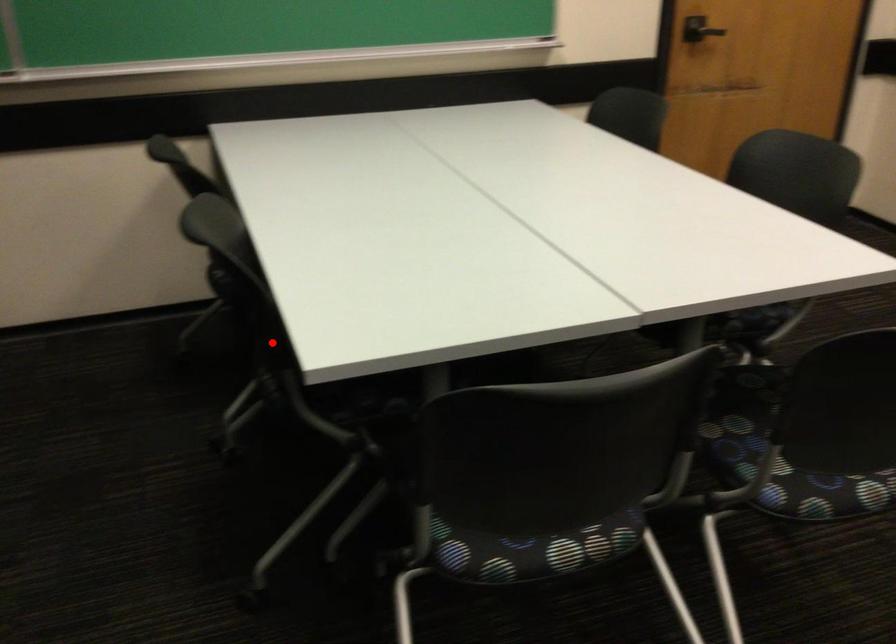
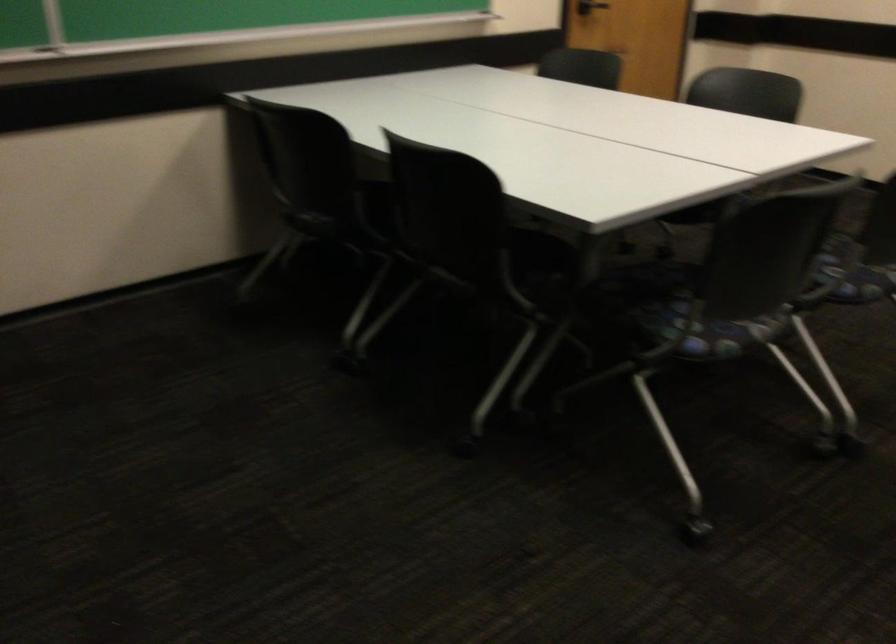
Question: I am providing you with two images of the same scene from different viewpoints. Image1 has a red point marked. In image2, the corresponding 3D location appears at what relative position? Reply with the corresponding letter.

Choices:
 (A) Closer
 (B) Farther

Answer: (B)